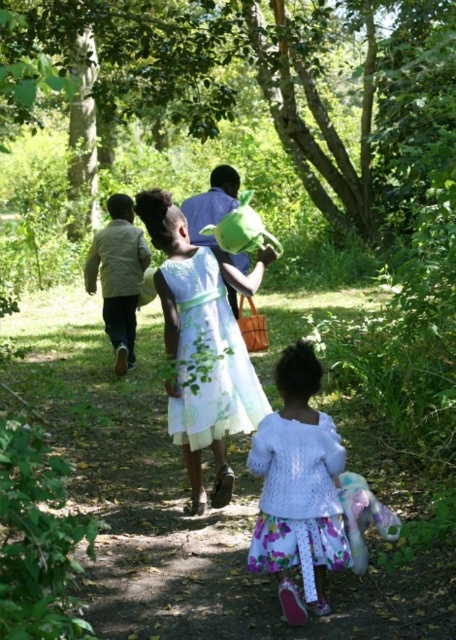
Does point (285, 10) lie behind point (237, 349)?

That is True.

In the scene shown: Is green leafy trees at center above light green fabric dress at center?

Correct, green leafy trees at center is located above light green fabric dress at center.

Find the location of a particular element. This screenshot has width=456, height=640. green leafy trees at center is located at coordinates (273, 83).

Measure the distance between green leafy trees at center and light brown leather jacket at left.

They are 19.85 feet apart.

Does green leafy trees at center appear under light brown leather jacket at left?

No.

Between point (217, 129) and point (124, 202), which one is positioned in front?

Point (217, 129) is more forward.

Where is `green leafy trees at center`? The width and height of the screenshot is (456, 640). green leafy trees at center is located at coordinates (273, 83).

Does light green fabric dress at center appear over light brown leather jacket at left?

Actually, light green fabric dress at center is below light brown leather jacket at left.

Looking at this image, is light green fabric dress at center smaller than light brown leather jacket at left?

Incorrect, light green fabric dress at center is not smaller in size than light brown leather jacket at left.

Image resolution: width=456 pixels, height=640 pixels. I want to click on light green fabric dress at center, so click(x=203, y=342).

At what (x,y) coordinates should I click in order to perform the action: click on light green fabric dress at center. Please return your answer as a coordinate pair (x, y). The width and height of the screenshot is (456, 640). Looking at the image, I should click on (203, 342).